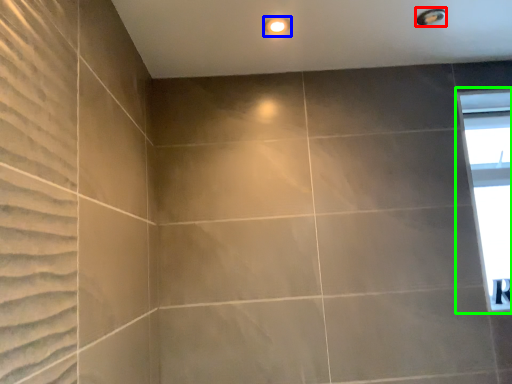
Question: Which object is positioned farthest from shower (highlighted by a red box)? Select from lighting (highlighted by a blue box) and window (highlighted by a green box).

Choices:
 (A) lighting
 (B) window

Answer: (B)